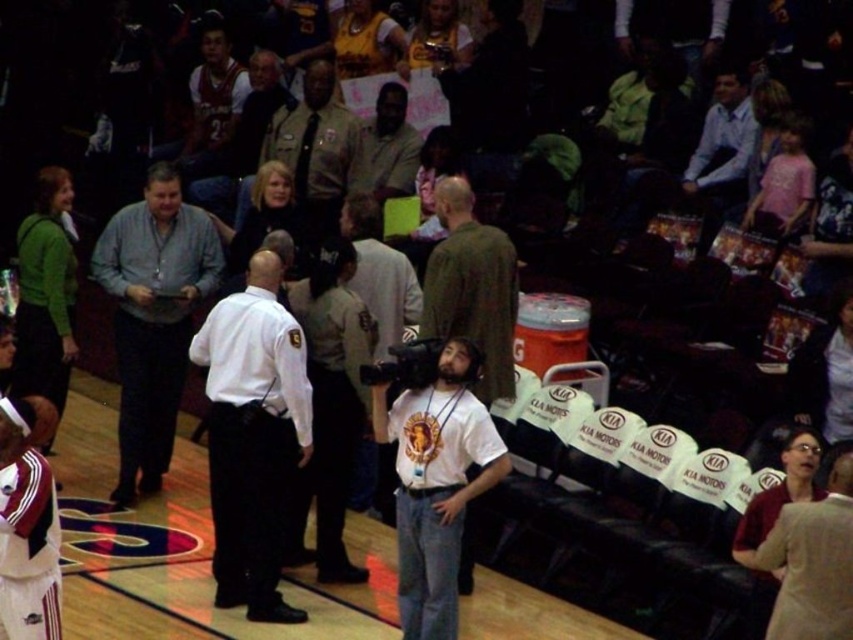
Does white matte t-shirt at center appear over brown uniformed officer at center?

Incorrect, white matte t-shirt at center is not positioned above brown uniformed officer at center.

Is white matte t-shirt at center closer to camera compared to brown uniformed officer at center?

Yes, white matte t-shirt at center is closer to the viewer.

Describe the element at coordinates (436, 483) in the screenshot. I see `white matte t-shirt at center` at that location.

The width and height of the screenshot is (853, 640). I want to click on white matte t-shirt at center, so click(x=436, y=483).

Which of these two, green matte shirt at center or dark blue shirt at center, stands taller?

green matte shirt at center is taller.

Can you confirm if green matte shirt at center is taller than dark blue shirt at center?

Yes, green matte shirt at center is taller than dark blue shirt at center.

Who is more distant from viewer, (485, 264) or (229, 268)?

The point (229, 268) is more distant.

Image resolution: width=853 pixels, height=640 pixels. Identify the location of green matte shirt at center. (471, 288).

Is green matte shirt at center taller than white jersey at center?

Yes, green matte shirt at center is taller than white jersey at center.

Does green matte shirt at center have a smaller size compared to white jersey at center?

No.

Does point (476, 328) come farther from viewer compared to point (21, 442)?

Yes, it is.

Find the location of a particular element. green matte shirt at center is located at coordinates (471, 288).